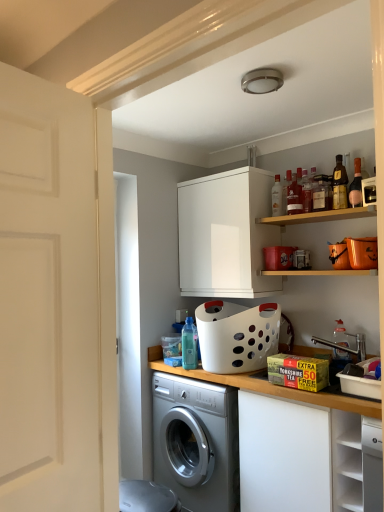
Question: Based on their positions, is wooden countertop at lower center located to the left or right of pink glass bottle at upper right, which is the 7th bottle in left-to-right order?

Choices:
 (A) left
 (B) right

Answer: (A)

Question: Considering the positions of wooden countertop at lower center and pink glass bottle at upper right, acting as the first bottle starting from the right, in the image, is wooden countertop at lower center wider or thinner than pink glass bottle at upper right, acting as the first bottle starting from the right,?

Choices:
 (A) wide
 (B) thin

Answer: (A)

Question: Estimate the real-world distances between objects in this image. Which object is closer to the wooden shelf at upper right?

Choices:
 (A) pink glass bottle at upper right, which is the 7th bottle in left-to-right order
 (B) translucent glass bottle at upper right, placed as the 3th bottle when sorted from right to left
 (C) white plastic basket at center
 (D) shiny brown bottle at upper right, arranged as the 6th bottle when viewed from the left
 (E) wooden countertop at lower center

Answer: (B)

Question: Based on their relative distances, which object is nearer to the white plastic basket at center?

Choices:
 (A) white matte cabinet at lower right, the second cabinetry in the left-to-right sequence
 (B) wooden shelf at upper right
 (C) translucent plastic bottle at upper center, which is the second bottle from left to right
 (D) translucent glass bottle at upper center, positioned as the 3th bottle in left-to-right order
 (E) shiny brown bottle at upper right, arranged as the 6th bottle when viewed from the left

Answer: (B)